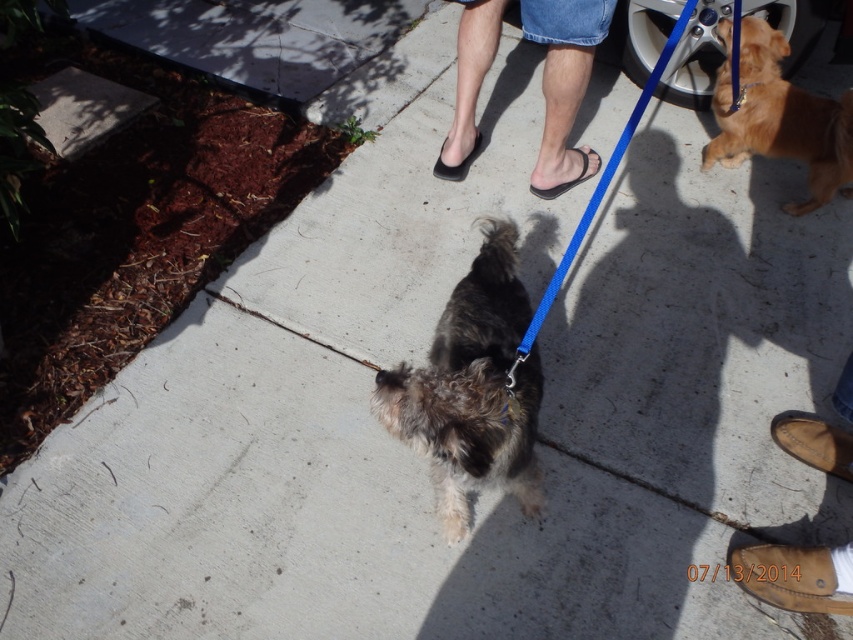
Question: Which point appears farthest from the camera in this image?

Choices:
 (A) (779, 589)
 (B) (440, 170)

Answer: (B)

Question: Among these objects, which one is farthest from the camera?

Choices:
 (A) golden fur dog at right
 (B) black matte sandal at center

Answer: (B)

Question: Estimate the real-world distances between objects in this image. Which object is farther from the black leather sandal at center?

Choices:
 (A) brown leather sandal at lower right
 (B) fuzzy brown dog at center
 (C) black matte sandal at center

Answer: (A)

Question: Does golden fur dog at right have a smaller size compared to brown leather shoes at lower right?

Choices:
 (A) no
 (B) yes

Answer: (A)

Question: Can you confirm if fuzzy brown dog at center is positioned below black matte sandal at center?

Choices:
 (A) no
 (B) yes

Answer: (B)

Question: Can you confirm if golden fur dog at right is positioned to the left of brown leather shoes at lower right?

Choices:
 (A) no
 (B) yes

Answer: (A)